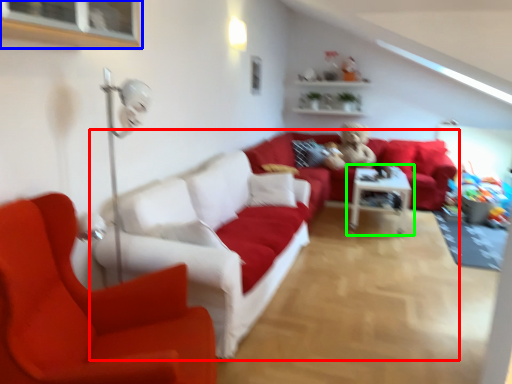
Question: Which is farther away from studio couch (highlighted by a red box)? window (highlighted by a blue box) or table (highlighted by a green box)?

Choices:
 (A) window
 (B) table

Answer: (B)